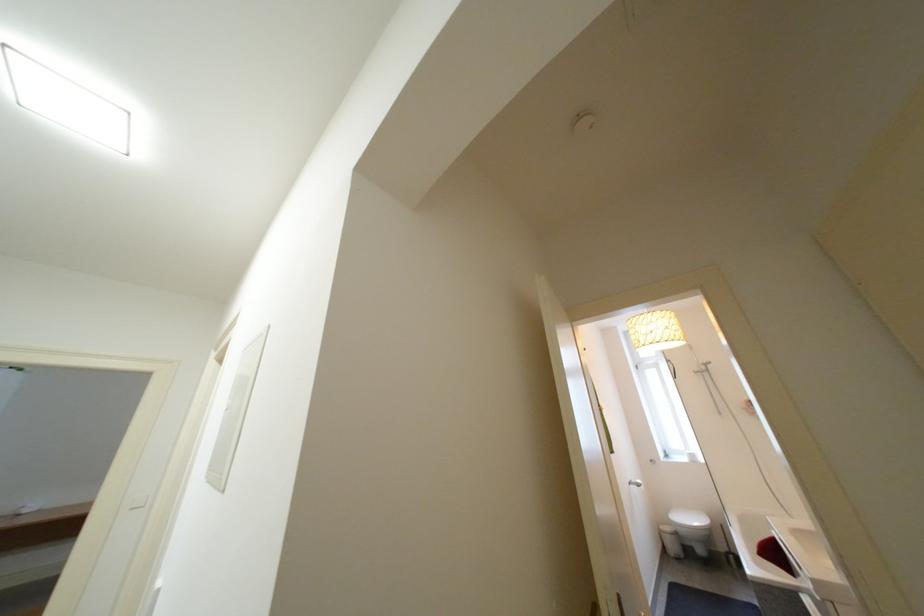
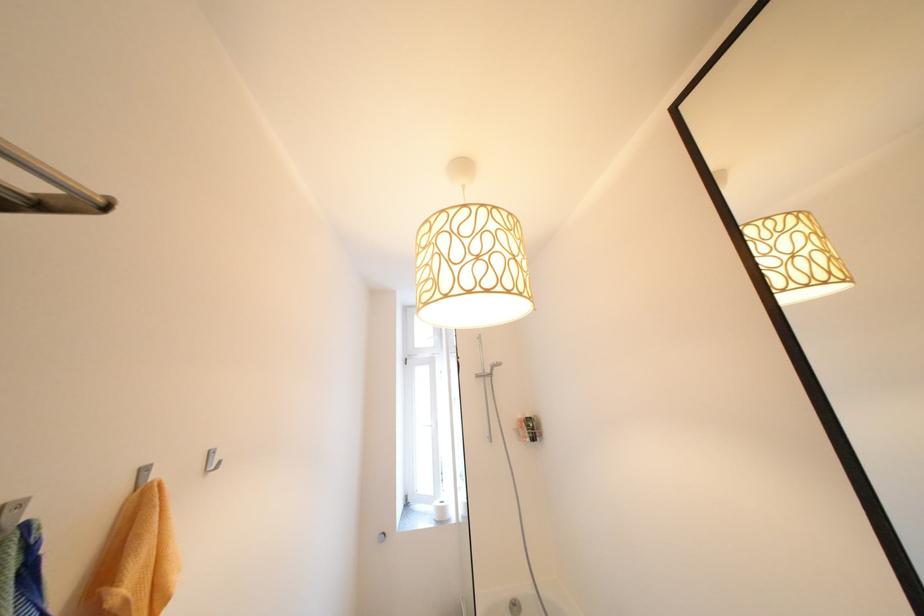
Locate, in the second image, the point that corresponds to (698,453) in the first image.

(447, 504)